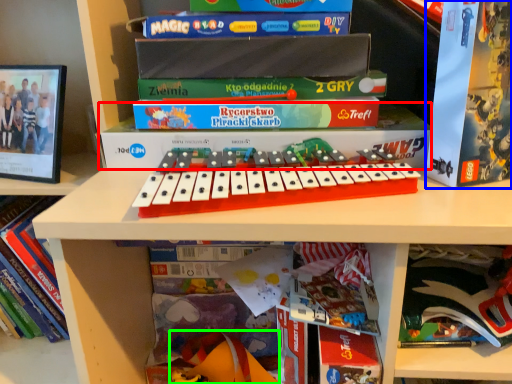
Question: Estimate the real-world distances between objects in this image. Which object is farther from paperback book (highlighted by a red box), paperback book (highlighted by a blue box) or toy (highlighted by a green box)?

Choices:
 (A) paperback book
 (B) toy

Answer: (B)